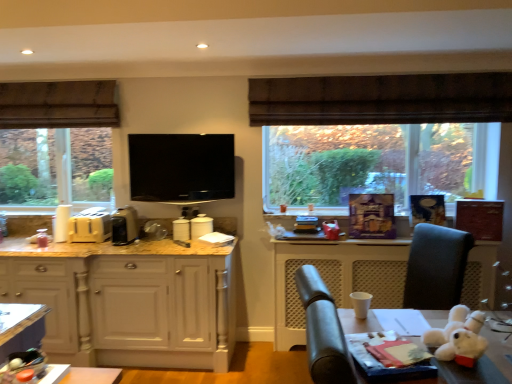
Locate an element on the screen. The image size is (512, 384). metallic silver coffee machine at left, acting as the second appliance starting from the left is located at coordinates (124, 226).

Locate an element on the screen. brown fabric exhaust hood at upper left is located at coordinates (58, 104).

The width and height of the screenshot is (512, 384). Describe the element at coordinates (201, 226) in the screenshot. I see `white glossy canister at center, which ranks as the first appliance in right-to-left order` at that location.

Identify the location of white plush toy at lower right. (458, 335).

In the scene shown: What is the approximate width of white plush toy at lower right?

8.72 inches.

Measure the distance between point (217, 346) and camera.

Point (217, 346) and camera are 3.10 meters apart from each other.

In order to click on white paper at lower right in this screenshot , I will do `click(336, 278)`.

From a real-world perspective, relative to black glossy tv at center, is white glossy toaster at center, the 3th appliance viewed from the left, vertically above or below?

In terms of real-world spatial position, white glossy toaster at center, the 3th appliance viewed from the left, is below black glossy tv at center.

Where is `television above the white glossy toaster at center, the 3th appliance viewed from the left (from the image's perspective)`? television above the white glossy toaster at center, the 3th appliance viewed from the left (from the image's perspective) is located at coordinates (181, 167).

Can you confirm if white glossy toaster at center, which is counted as the second appliance, starting from the right, is wider than black glossy tv at center?

Indeed, white glossy toaster at center, which is counted as the second appliance, starting from the right, has a greater width compared to black glossy tv at center.

Is white glossy toaster at center, the 3th appliance viewed from the left, closer to camera compared to black glossy tv at center?

That is False.

Is matte wood cabinetry at left positioned far away from white glossy canister at center, arranged as the 4th appliance when viewed from the left?

No, matte wood cabinetry at left is not far from white glossy canister at center, arranged as the 4th appliance when viewed from the left.

Which object is closer to the camera, matte wood cabinetry at left or white glossy canister at center, which ranks as the first appliance in right-to-left order?

matte wood cabinetry at left is more forward.

From the image's perspective, who appears lower, matte wood cabinetry at left or white glossy canister at center, which ranks as the first appliance in right-to-left order?

matte wood cabinetry at left, from the image's perspective.

Considering the relative sizes of matte wood cabinetry at left and white glossy canister at center, arranged as the 4th appliance when viewed from the left, in the image provided, is matte wood cabinetry at left wider than white glossy canister at center, arranged as the 4th appliance when viewed from the left,?

Indeed, matte wood cabinetry at left has a greater width compared to white glossy canister at center, arranged as the 4th appliance when viewed from the left.

From the picture: Which of these two, black glossy tv at center or white glossy toaster at center, which is counted as the second appliance, starting from the right, is wider?

Wider between the two is white glossy toaster at center, which is counted as the second appliance, starting from the right.

From the picture: From a real-world perspective, which object stands above the other?

black glossy tv at center, from a real-world perspective.

Locate an element on the screen. Image resolution: width=512 pixels, height=384 pixels. television above the white glossy toaster at center, the 3th appliance viewed from the left (from the image's perspective) is located at coordinates (181, 167).

Is black glossy tv at center not inside white glossy toaster at center, which is counted as the second appliance, starting from the right?

Yes.

From a real-world perspective, between white glossy toaster at center, which is counted as the second appliance, starting from the right, and metallic silver coffee machine at left, acting as the second appliance starting from the left, who is vertically lower?

From a 3D spatial view, white glossy toaster at center, which is counted as the second appliance, starting from the right, is below.

From the picture: How many degrees apart are the facing directions of white glossy toaster at center, which is counted as the second appliance, starting from the right, and metallic silver coffee machine at left, which ranks as the 3th appliance in right-to-left order?

They differ by 0.000565 degrees in their facing directions.

Looking at this image, is white glossy toaster at center, the 3th appliance viewed from the left, oriented towards metallic silver coffee machine at left, which ranks as the 3th appliance in right-to-left order?

No, white glossy toaster at center, the 3th appliance viewed from the left, is not oriented towards metallic silver coffee machine at left, which ranks as the 3th appliance in right-to-left order.

Considering the positions of objects white glossy toaster at center, which is counted as the second appliance, starting from the right, and metallic silver coffee machine at left, acting as the second appliance starting from the left, in the image provided, who is more to the right, white glossy toaster at center, which is counted as the second appliance, starting from the right, or metallic silver coffee machine at left, acting as the second appliance starting from the left,?

white glossy toaster at center, which is counted as the second appliance, starting from the right.

Looking at this image, which point is more forward, (91, 218) or (175, 223)?

The point (91, 218) is in front.

Looking at the image, does matte yellow toaster at left, positioned as the first appliance in left-to-right order, seem bigger or smaller compared to white glossy toaster at center, which is counted as the second appliance, starting from the right?

Considering their sizes, matte yellow toaster at left, positioned as the first appliance in left-to-right order, takes up more space than white glossy toaster at center, which is counted as the second appliance, starting from the right.

Would you say matte yellow toaster at left, positioned as the first appliance in left-to-right order, is a long distance from white glossy toaster at center, which is counted as the second appliance, starting from the right?

matte yellow toaster at left, positioned as the first appliance in left-to-right order, is actually quite close to white glossy toaster at center, which is counted as the second appliance, starting from the right.

Between matte yellow toaster at left, positioned as the first appliance in left-to-right order, and white glossy toaster at center, the 3th appliance viewed from the left, which one is positioned behind?

white glossy toaster at center, the 3th appliance viewed from the left, is further away from the camera.

Is matte white table at lower left shorter than white paper at lower right?

Indeed, matte white table at lower left has a lesser height compared to white paper at lower right.

Considering the sizes of objects matte white table at lower left and white paper at lower right in the image provided, who is thinner, matte white table at lower left or white paper at lower right?

→ With smaller width is white paper at lower right.

From a real-world perspective, who is located higher, matte white table at lower left or white paper at lower right?

From a 3D spatial view, matte white table at lower left is above.

Is matte yellow toaster at left, positioned as the first appliance in left-to-right order, outside of metallic silver coffee machine at left, acting as the second appliance starting from the left?

matte yellow toaster at left, positioned as the first appliance in left-to-right order, lies outside metallic silver coffee machine at left, acting as the second appliance starting from the left,'s area.

From a real-world perspective, is matte yellow toaster at left, the fourth appliance viewed from the right, positioned under metallic silver coffee machine at left, which ranks as the 3th appliance in right-to-left order, based on gravity?

Yes, from a real-world perspective, matte yellow toaster at left, the fourth appliance viewed from the right, is under metallic silver coffee machine at left, which ranks as the 3th appliance in right-to-left order.

Considering the relative positions of matte yellow toaster at left, positioned as the first appliance in left-to-right order, and metallic silver coffee machine at left, which ranks as the 3th appliance in right-to-left order, in the image provided, is matte yellow toaster at left, positioned as the first appliance in left-to-right order, to the left or to the right of metallic silver coffee machine at left, which ranks as the 3th appliance in right-to-left order,?

Based on their positions, matte yellow toaster at left, positioned as the first appliance in left-to-right order, is located to the left of metallic silver coffee machine at left, which ranks as the 3th appliance in right-to-left order.

Could you tell me if matte yellow toaster at left, positioned as the first appliance in left-to-right order, is turned towards metallic silver coffee machine at left, which ranks as the 3th appliance in right-to-left order?

No, matte yellow toaster at left, positioned as the first appliance in left-to-right order, is not turned towards metallic silver coffee machine at left, which ranks as the 3th appliance in right-to-left order.

The width and height of the screenshot is (512, 384). I want to click on television located on the right of white glossy toaster at center, which is counted as the second appliance, starting from the right, so click(181, 167).

Find the location of a particular element. cabinetry below the white glossy canister at center, arranged as the 4th appliance when viewed from the left (from the image's perspective) is located at coordinates [x=128, y=301].

When comparing their distances from white paper at lower right, does black glossy tv at center or brown fabric exhaust hood at upper left seem closer?

black glossy tv at center is positioned closer to the anchor white paper at lower right.

Considering their positions, is white paper at lower right positioned closer to white glossy toaster at center, which is counted as the second appliance, starting from the right, than matte white table at lower left?

Based on the image, white paper at lower right appears to be nearer to white glossy toaster at center, which is counted as the second appliance, starting from the right.

When comparing their distances from white paper at lower right, does brown fabric exhaust hood at upper left or metallic silver coffee machine at left, acting as the second appliance starting from the left, seem further?

brown fabric exhaust hood at upper left.

Estimate the real-world distances between objects in this image. Which object is further from black glossy tv at center, matte white table at lower left or matte yellow toaster at left, the fourth appliance viewed from the right?

matte white table at lower left.

When comparing their distances from white glossy canister at center, arranged as the 4th appliance when viewed from the left, does matte wood cabinetry at left or matte yellow toaster at left, positioned as the first appliance in left-to-right order, seem further?

matte yellow toaster at left, positioned as the first appliance in left-to-right order, lies further to white glossy canister at center, arranged as the 4th appliance when viewed from the left, than the other object.

When comparing their distances from white glossy canister at center, which ranks as the first appliance in right-to-left order, does brown fabric exhaust hood at upper left or white glossy toaster at center, which is counted as the second appliance, starting from the right, seem closer?

Among the two, white glossy toaster at center, which is counted as the second appliance, starting from the right, is located nearer to white glossy canister at center, which ranks as the first appliance in right-to-left order.

Estimate the real-world distances between objects in this image. Which object is closer to matte white table at lower left, white glossy toaster at center, which is counted as the second appliance, starting from the right, or white glossy canister at center, arranged as the 4th appliance when viewed from the left?

white glossy toaster at center, which is counted as the second appliance, starting from the right, is positioned closer to the anchor matte white table at lower left.

Looking at the image, which one is located closer to brown fabric exhaust hood at upper left, matte wood cabinetry at left or white paper at lower right?

matte wood cabinetry at left is positioned closer to the anchor brown fabric exhaust hood at upper left.

I want to click on table situated between metallic silver coffee machine at left, acting as the second appliance starting from the left, and white plush toy at lower right from left to right, so click(x=80, y=375).

In order to click on counter located between matte white table at lower left and white glossy canister at center, arranged as the 4th appliance when viewed from the left, in the depth direction in this screenshot , I will do `click(336, 278)`.

This screenshot has height=384, width=512. I want to click on television between metallic silver coffee machine at left, acting as the second appliance starting from the left, and white plush toy at lower right, so click(181, 167).

This screenshot has width=512, height=384. What are the coordinates of `television positioned between white plush toy at lower right and white paper at lower right from near to far` in the screenshot? It's located at (181, 167).